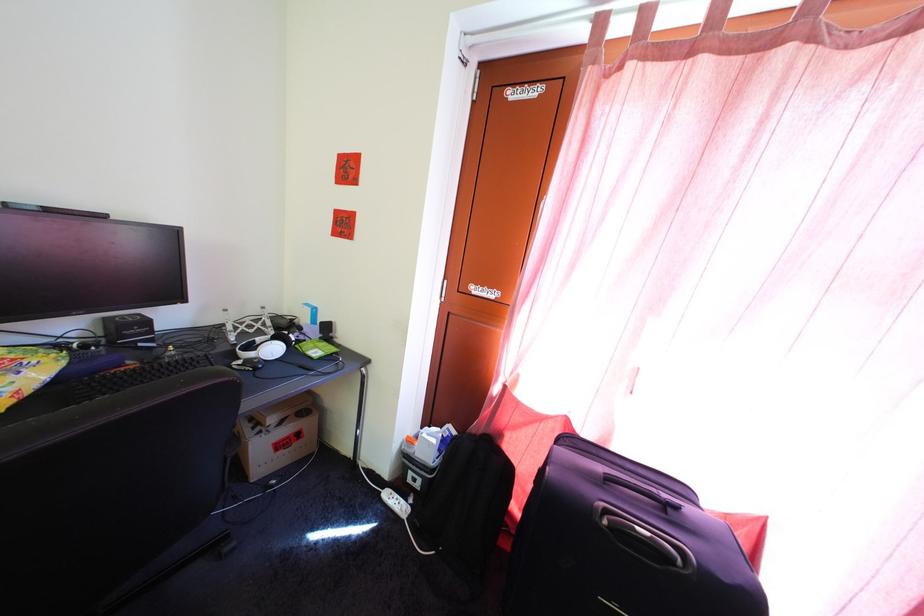
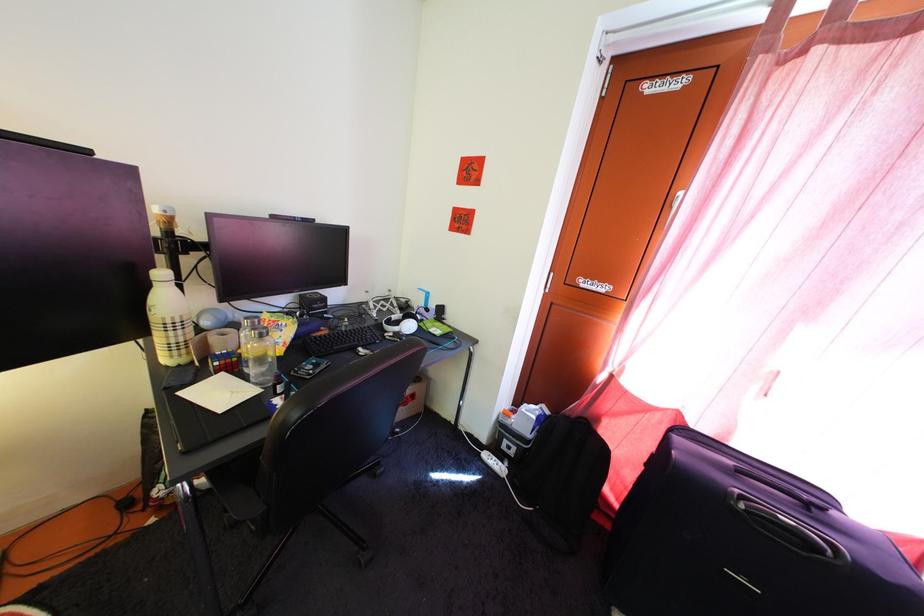
Where in the second image is the point corresponding to the point at 393,493 from the first image?

(492, 456)